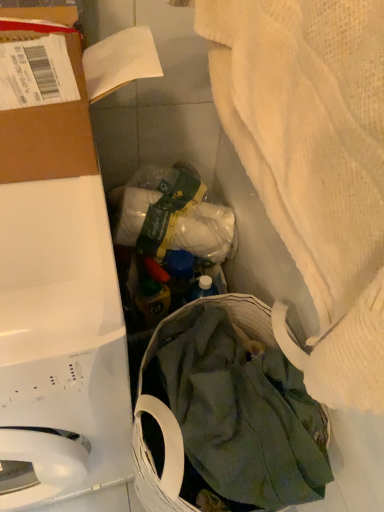
Question: Based on their positions, is brown cardboard at upper left located to the left or right of white textured towel at upper right?

Choices:
 (A) right
 (B) left

Answer: (B)

Question: In terms of height, does brown cardboard at upper left look taller or shorter compared to white textured towel at upper right?

Choices:
 (A) tall
 (B) short

Answer: (B)

Question: Which object is positioned farthest from the brown cardboard at upper left?

Choices:
 (A) white glossy washing machine at left
 (B) green cotton cloth at lower center
 (C) white fabric at center
 (D) white textured towel at upper right

Answer: (B)

Question: Based on their relative distances, which object is nearer to the green cotton cloth at lower center?

Choices:
 (A) white textured towel at upper right
 (B) brown cardboard at upper left
 (C) white fabric at center
 (D) white glossy washing machine at left

Answer: (D)